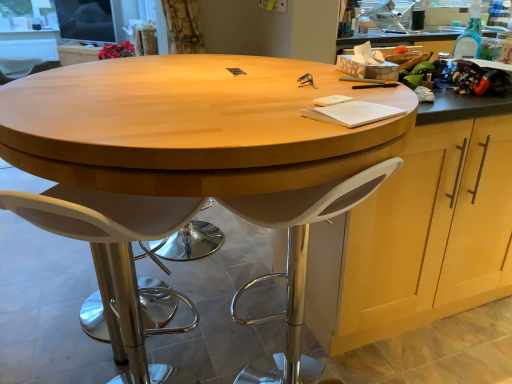
This screenshot has height=384, width=512. I want to click on vacant space behind white plastic stool at center, so click(255, 336).